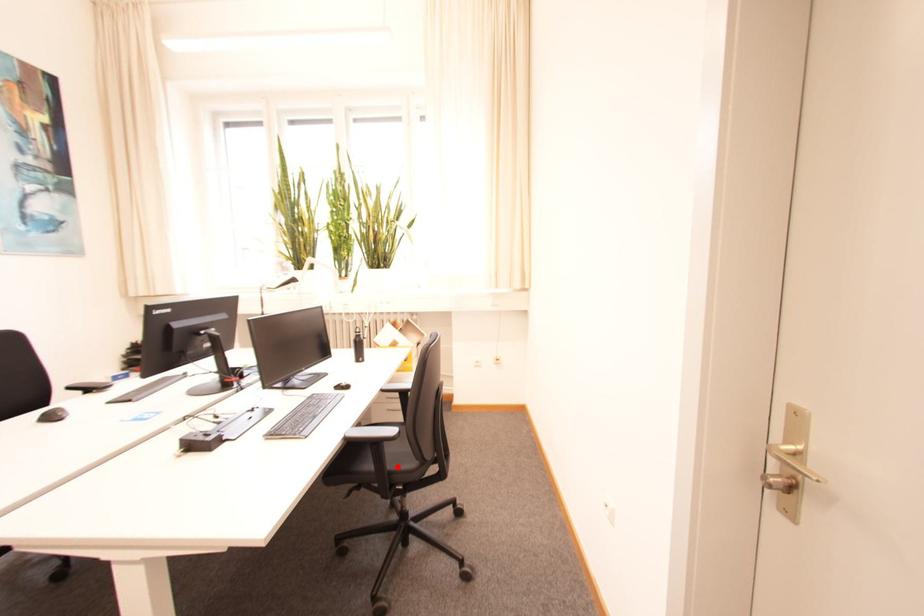
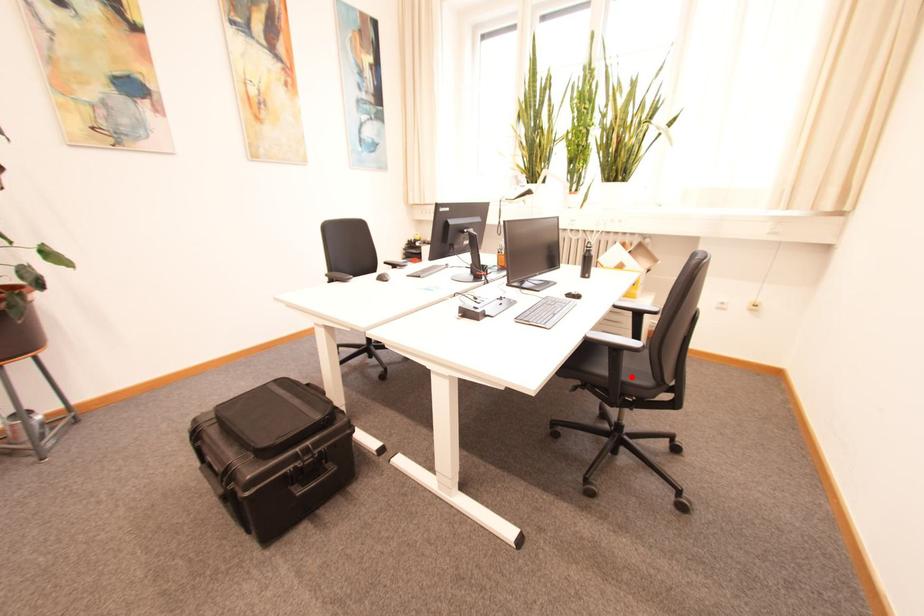
I am providing you with two images of the same scene from different viewpoints. A red point is marked on the first image and another point is marked on the second image. Is the marked point in image1 the same physical position as the marked point in image2?

Yes